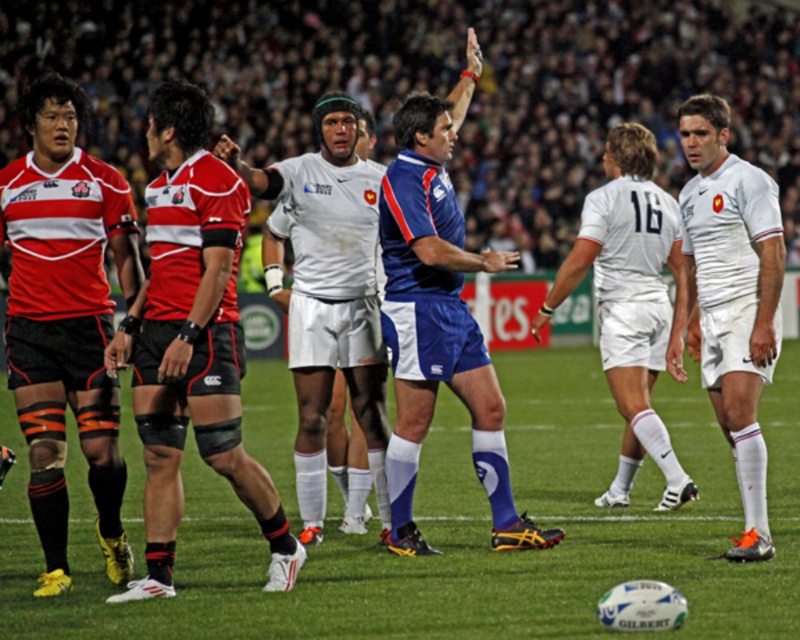
You are a spectator at the rugby match and want to find the matte red rugby jersey at left. According to the coordinate system where the bottom left corner is the origin, can you determine if it is closer to the left boundary or the right boundary?

The matte red rugby jersey at left is located at point (66,317). Since the x coordinate is 0.497, which is just under 0.5, it is closer to the left boundary than the right boundary in the horizontal axis.

You are a spectator at the rugby match and notice two players wearing the same team colors. The first is wearing a matte red rugby jersey at left, and the second is wearing a matte red jersey at left. Which player is positioned further to the left side of the field?

The matte red rugby jersey at left is positioned further to the left than the matte red jersey at left.

You are a spectator at the rugby match and want to take a photo of the matte red jersey at left and the blue synthetic referee at center. Which one should you zoom in on more to ensure both are in focus?

The matte red jersey at left is not as tall as the blue synthetic referee at center, so you should zoom in more on the blue synthetic referee at center to ensure both are in focus.